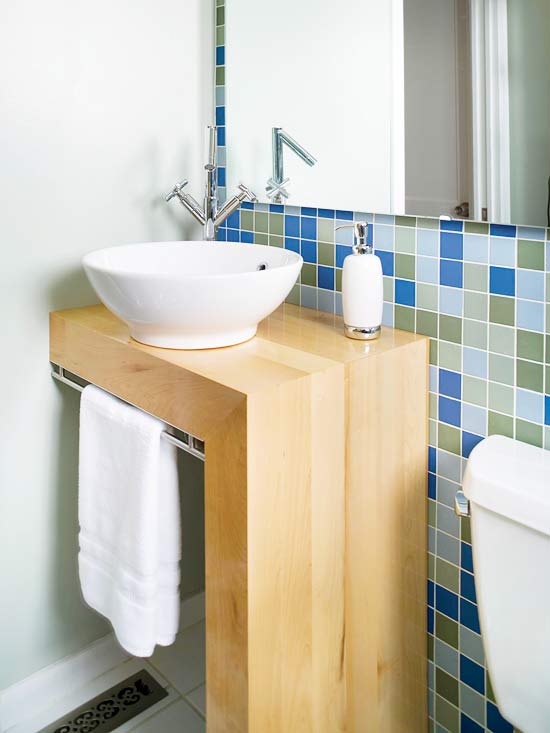
Identify the location of towel. The image size is (550, 733). pyautogui.click(x=126, y=515).